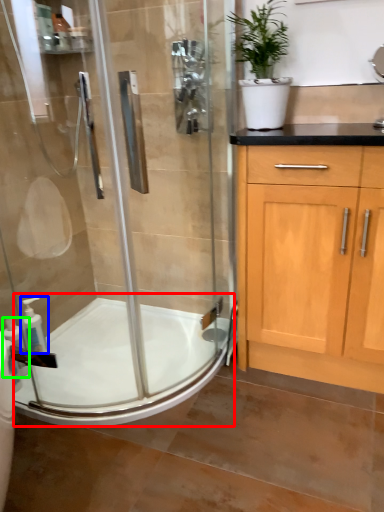
Question: Estimate the real-world distances between objects in this image. Which object is closer to bath (highlighted by a red box), soap dispenser (highlighted by a blue box) or soap dispenser (highlighted by a green box)?

Choices:
 (A) soap dispenser
 (B) soap dispenser

Answer: (A)